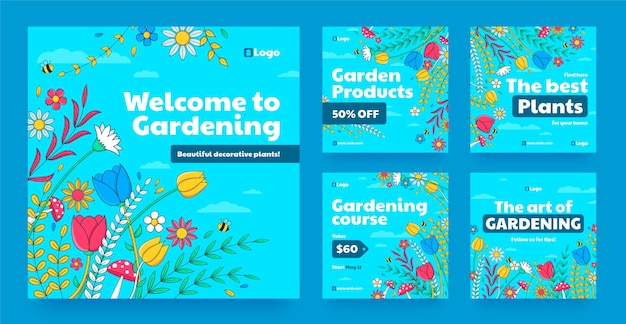
Locate an element on the screen. "the best plants" is located at coordinates (553, 90).